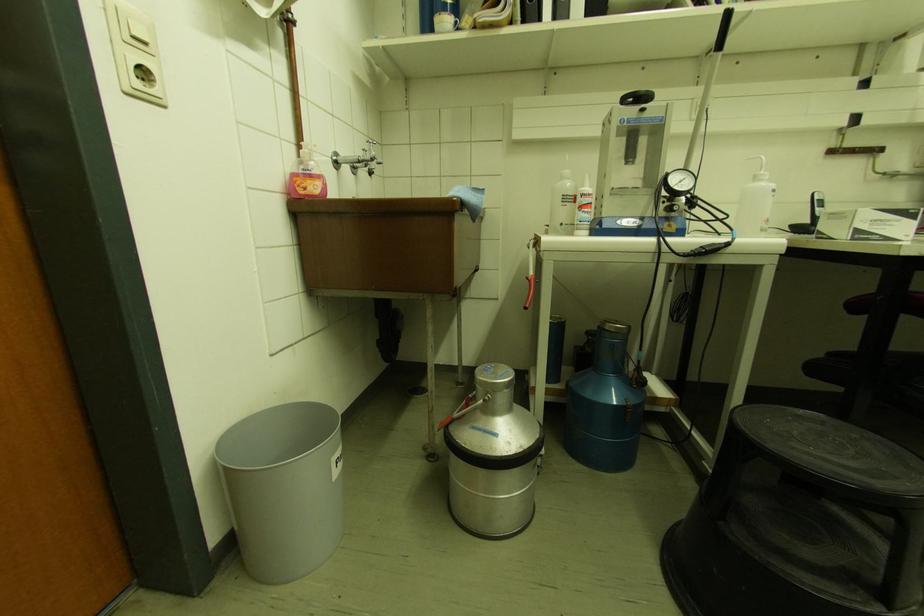
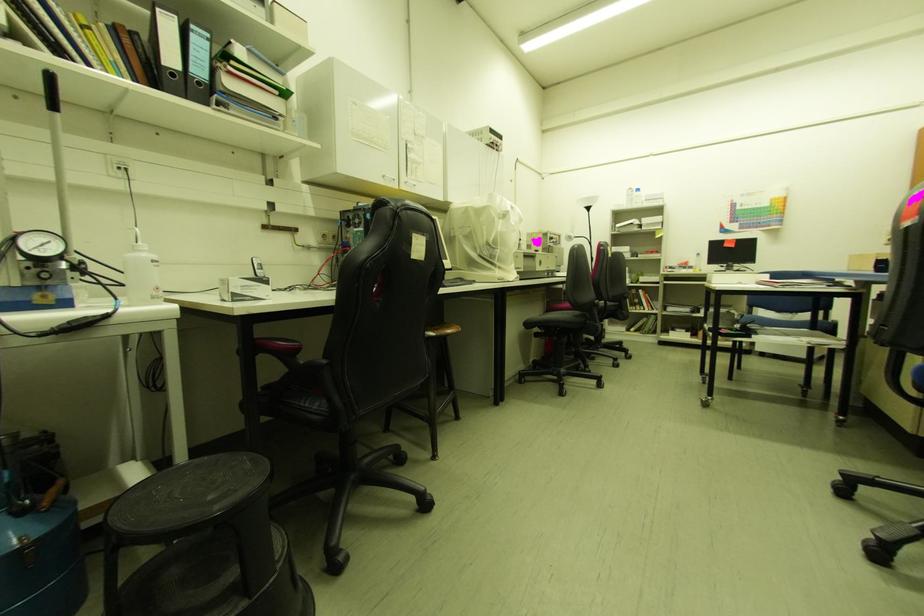
Question: How did the camera likely rotate?

Choices:
 (A) Left
 (B) Right
 (C) Up
 (D) Down

Answer: (B)